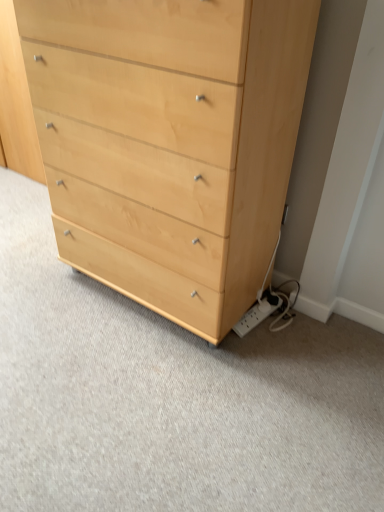
Locate an element on the screen. free space to the left of light wood chest of drawers at center is located at coordinates tap(42, 285).